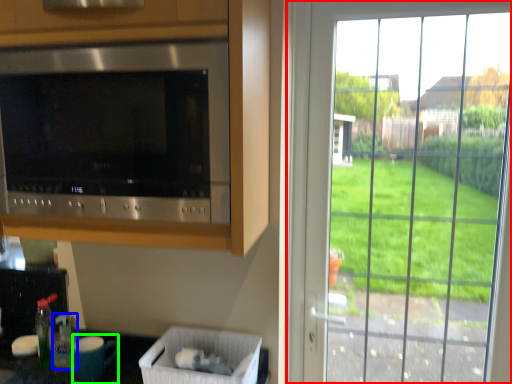
Question: Which object is positioned farthest from window (highlighted by a red box)? Select from bottle (highlighted by a blue box) and appliance (highlighted by a green box).

Choices:
 (A) bottle
 (B) appliance

Answer: (A)